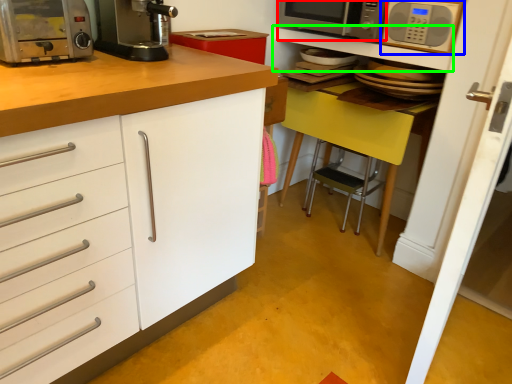
Question: Which is nearer to the microwave oven (highlighted by a red box)? microwave oven (highlighted by a blue box) or shelf (highlighted by a green box).

Choices:
 (A) microwave oven
 (B) shelf

Answer: (B)